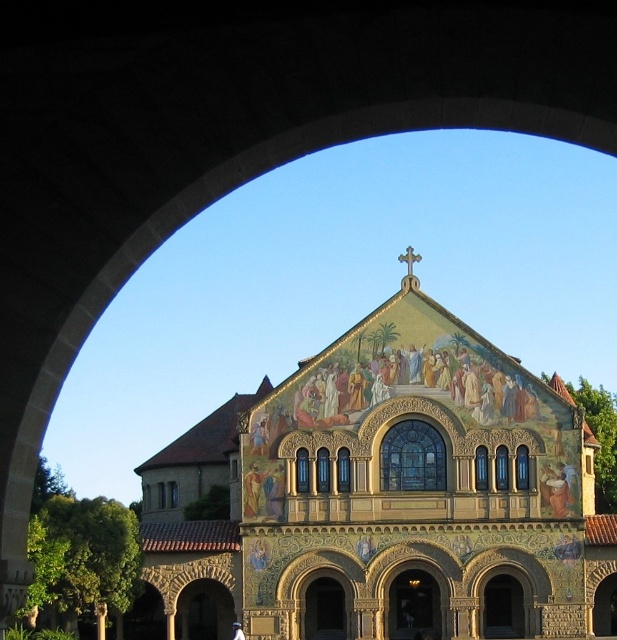
Is golden mosaic church at center taller than white stone pillar at lower left?

Indeed, golden mosaic church at center has a greater height compared to white stone pillar at lower left.

Is golden mosaic church at center thinner than white stone pillar at lower left?

No.

The image size is (617, 640). I want to click on golden mosaic church at center, so click(x=386, y=496).